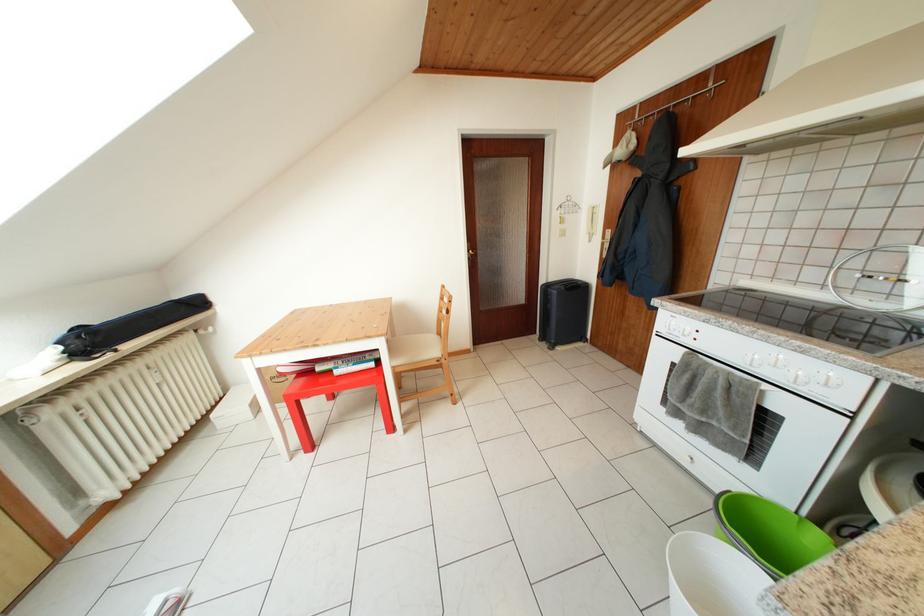
Locate an element on the screen. oven drawer handle is located at coordinates (736, 471).